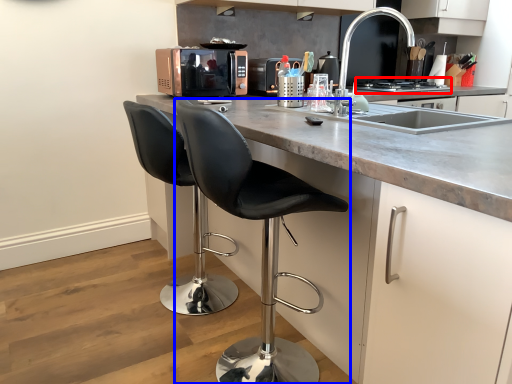
Question: Among these objects, which one is farthest to the camera, stove (highlighted by a red box) or chair (highlighted by a blue box)?

Choices:
 (A) stove
 (B) chair

Answer: (A)